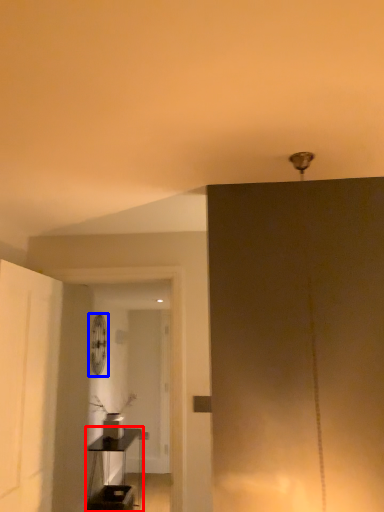
Question: Which object appears farthest to the camera in this image, table (highlighted by a red box) or fan (highlighted by a blue box)?

Choices:
 (A) table
 (B) fan

Answer: (B)